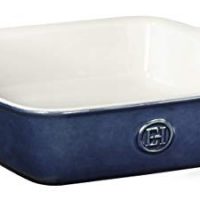
Where is `bowl`? bowl is located at coordinates (105, 91).